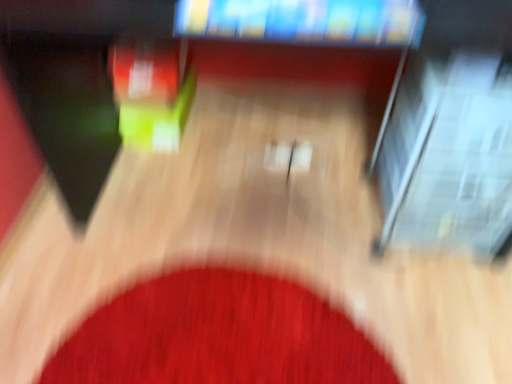
Question: Looking at their shapes, would you say red carpet at center is wider or thinner than matte plastic television at upper center?

Choices:
 (A) wide
 (B) thin

Answer: (A)

Question: From their relative heights in the image, would you say red carpet at center is taller or shorter than matte plastic television at upper center?

Choices:
 (A) tall
 (B) short

Answer: (A)

Question: From a real-world perspective, is red carpet at center above or below matte plastic television at upper center?

Choices:
 (A) below
 (B) above

Answer: (A)

Question: From a real-world perspective, relative to red carpet at center, is matte plastic television at upper center vertically above or below?

Choices:
 (A) above
 (B) below

Answer: (A)

Question: Based on their positions, is matte plastic television at upper center located to the left or right of red carpet at center?

Choices:
 (A) right
 (B) left

Answer: (A)

Question: From the image's perspective, is matte plastic television at upper center above or below red carpet at center?

Choices:
 (A) above
 (B) below

Answer: (A)

Question: Based on their sizes in the image, would you say matte plastic television at upper center is bigger or smaller than red carpet at center?

Choices:
 (A) small
 (B) big

Answer: (A)